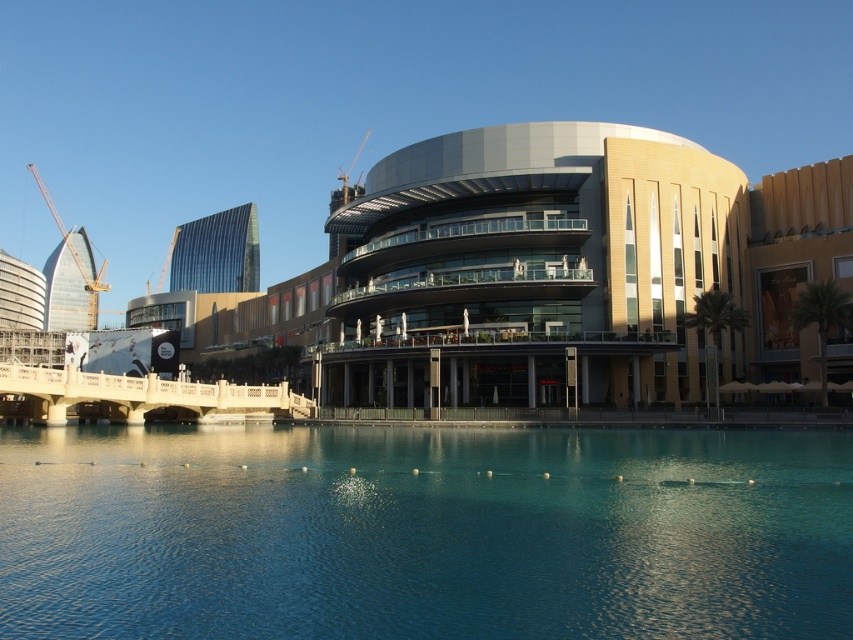
You are a tourist standing at the edge of the clear blue water at center. You want to take a photo of the matte glass building at center without any obstructions. Is the building visible from your current position?

The clear blue water at center is below the matte glass building at center, so the building is above the water. Since you are standing at the edge of the water, the matte glass building at center should be visible as it is positioned above the water level.

You are a city planner reviewing this urban design. You notice the clear blue water at center and the yellow construction crane at left. Based on their positions, which one is closer to the viewer?

The clear blue water at center is closer to the viewer than the yellow construction crane at left because it is positioned in front of it.

Looking at this image, you are an architect evaluating the urban landscape. You notice the clear blue water at center and the matte glass building at center. Which of these two elements is shorter in height?

The clear blue water at center is shorter in height compared to the matte glass building at center.